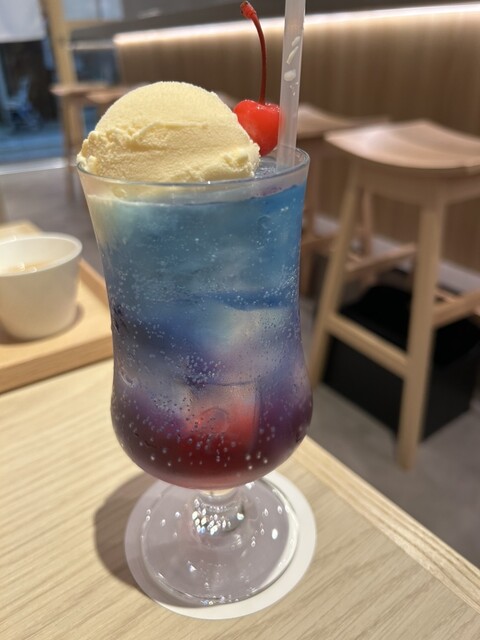
The image size is (480, 640). In order to click on floor in this screenshot , I will do `click(432, 490)`.